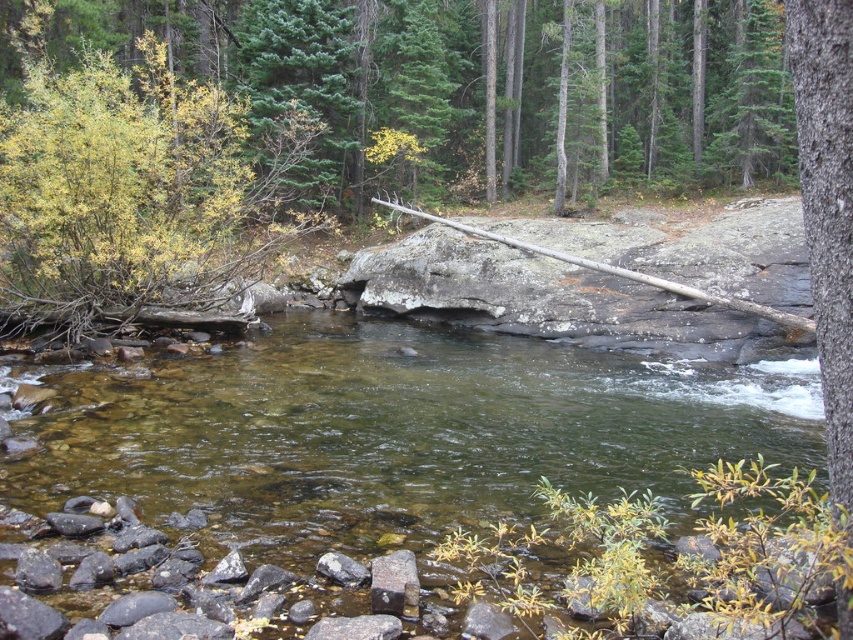
Is clear water at center to the left of yellow-green foliage at left from the viewer's perspective?

No, clear water at center is not to the left of yellow-green foliage at left.

At what (x,y) coordinates should I click in order to perform the action: click on clear water at center. Please return your answer as a coordinate pair (x, y). The height and width of the screenshot is (640, 853). Looking at the image, I should click on (372, 480).